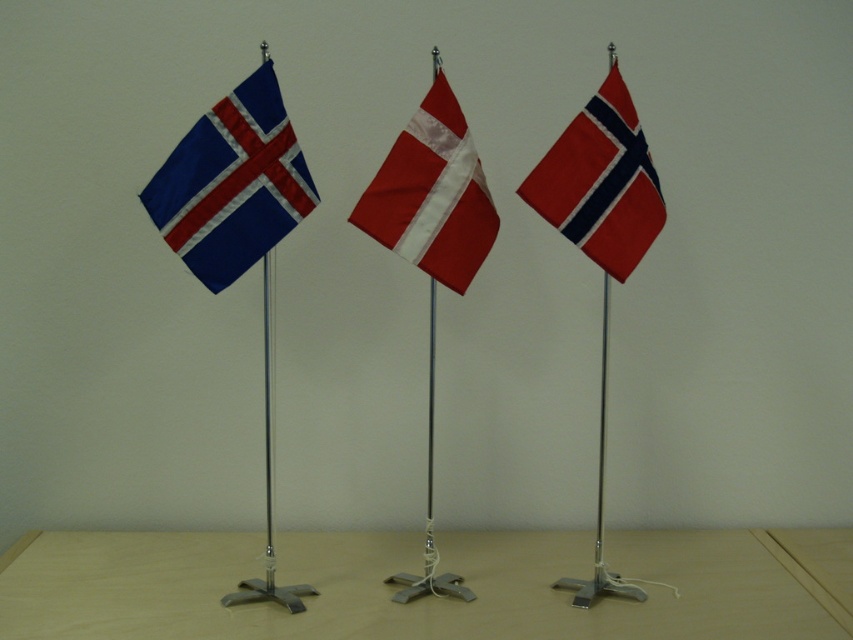
Does wooden table at center have a larger size compared to white glossy flag at center?

Indeed, wooden table at center has a larger size compared to white glossy flag at center.

Is the position of wooden table at center less distant than that of white glossy flag at center?

Yes, it is in front of white glossy flag at center.

Find the location of `wooden table at center`. wooden table at center is located at coordinates (426, 596).

In order to click on wooden table at center in this screenshot , I will do 426,596.

Does matte fabric flag at left have a greater width compared to red fabric flag at center?

Yes.

Is point (283, 140) farther from viewer compared to point (573, 129)?

No, it is not.

The width and height of the screenshot is (853, 640). In order to click on matte fabric flag at left in this screenshot , I will do `click(231, 182)`.

Is matte fabric flag at left thinner than white glossy flag at center?

Incorrect, matte fabric flag at left's width is not less than white glossy flag at center's.

Which is in front, point (271, 202) or point (442, 198)?

Point (271, 202)

The image size is (853, 640). What are the coordinates of `matte fabric flag at left` in the screenshot? It's located at (231, 182).